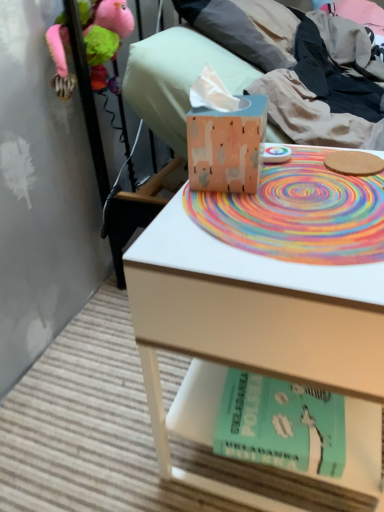
Question: From a real-world perspective, is rainbow spiral mat at center below teal matte paperback book at lower center?

Choices:
 (A) no
 (B) yes

Answer: (A)

Question: From a real-world perspective, is rainbow spiral mat at center positioned over teal matte paperback book at lower center based on gravity?

Choices:
 (A) no
 (B) yes

Answer: (B)

Question: Considering the relative sizes of rainbow spiral mat at center and teal matte paperback book at lower center in the image provided, is rainbow spiral mat at center shorter than teal matte paperback book at lower center?

Choices:
 (A) no
 (B) yes

Answer: (B)

Question: Is rainbow spiral mat at center not near teal matte paperback book at lower center?

Choices:
 (A) no
 (B) yes

Answer: (A)

Question: From the image's perspective, is rainbow spiral mat at center over teal matte paperback book at lower center?

Choices:
 (A) no
 (B) yes

Answer: (B)

Question: Is rainbow spiral mat at center taller or shorter than wooden table at center?

Choices:
 (A) tall
 (B) short

Answer: (B)

Question: From the image's perspective, relative to wooden table at center, is rainbow spiral mat at center above or below?

Choices:
 (A) below
 (B) above

Answer: (B)

Question: From a real-world perspective, is rainbow spiral mat at center positioned above or below wooden table at center?

Choices:
 (A) below
 (B) above

Answer: (B)

Question: Choose the correct answer: Is rainbow spiral mat at center inside wooden table at center or outside it?

Choices:
 (A) outside
 (B) inside

Answer: (B)

Question: In terms of size, does teal matte paperback book at lower center appear bigger or smaller than wooden tissue box at center?

Choices:
 (A) small
 (B) big

Answer: (A)

Question: From a real-world perspective, is teal matte paperback book at lower center physically located above or below wooden tissue box at center?

Choices:
 (A) below
 (B) above

Answer: (A)

Question: In the image, is teal matte paperback book at lower center on the left side or the right side of wooden tissue box at center?

Choices:
 (A) right
 (B) left

Answer: (A)

Question: Is point (249, 374) positioned closer to the camera than point (195, 173)?

Choices:
 (A) farther
 (B) closer

Answer: (A)

Question: Based on their sizes in the image, would you say soft pink plush toy at upper left is bigger or smaller than rainbow spiral mat at center?

Choices:
 (A) big
 (B) small

Answer: (A)

Question: From a real-world perspective, is soft pink plush toy at upper left above or below rainbow spiral mat at center?

Choices:
 (A) below
 (B) above

Answer: (B)